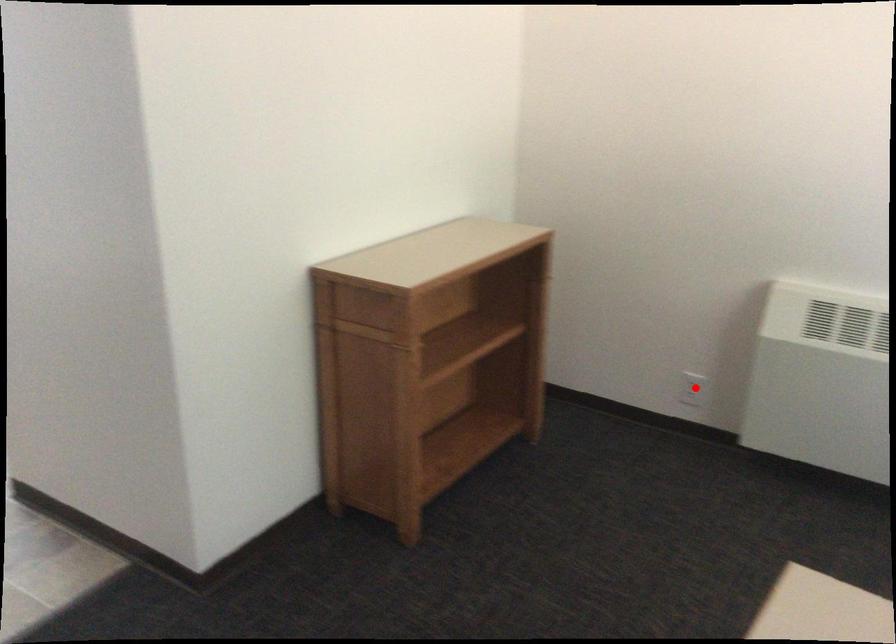
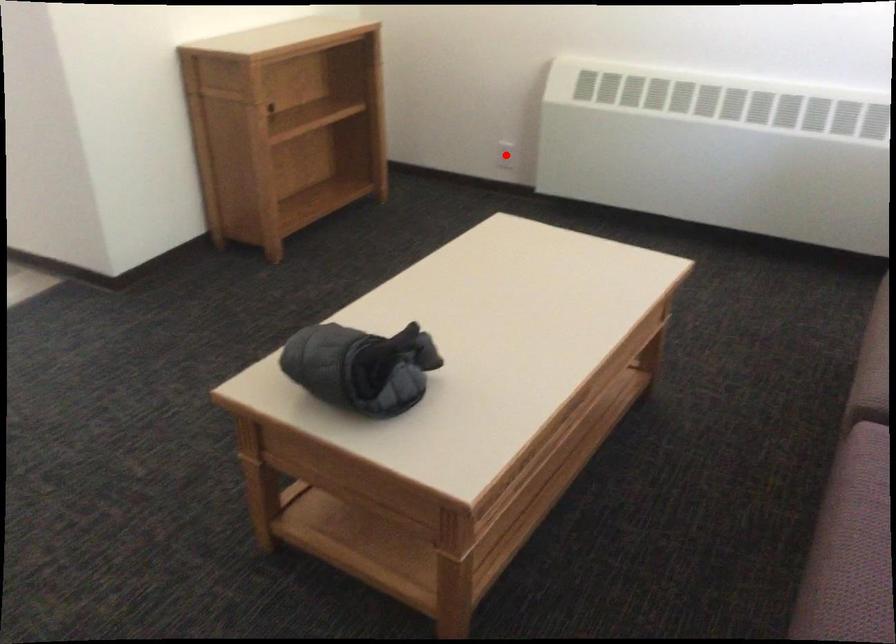
I am providing you with two images of the same scene from different viewpoints. A red point is marked on the first image and another point is marked on the second image. Do the highlighted points in image1 and image2 indicate the same real-world spot?

Yes